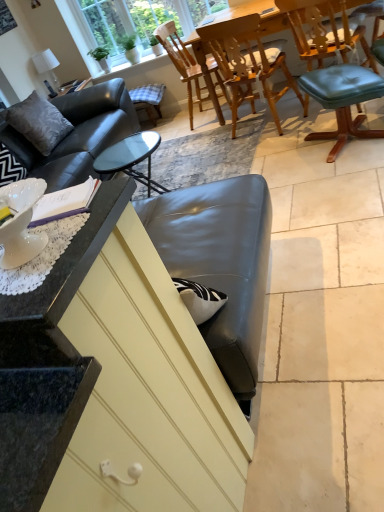
Question: Does wooden chair at upper center, the 1th chair from the left, have a larger size compared to gray suede pillow at upper left?

Choices:
 (A) no
 (B) yes

Answer: (B)

Question: Could gray suede pillow at upper left be considered to be inside wooden chair at upper center, the 1th chair from the left?

Choices:
 (A) yes
 (B) no

Answer: (B)

Question: From the image's perspective, is wooden chair at upper center, marked as the third chair in a right-to-left arrangement, located beneath gray suede pillow at upper left?

Choices:
 (A) no
 (B) yes

Answer: (A)

Question: Is wooden chair at upper center, the 1th chair from the left, facing away from gray suede pillow at upper left?

Choices:
 (A) yes
 (B) no

Answer: (B)

Question: From the image's perspective, is wooden chair at upper center, the 1th chair from the left, located above gray suede pillow at upper left?

Choices:
 (A) yes
 (B) no

Answer: (A)

Question: Can you confirm if wooden chair at upper center, marked as the third chair in a right-to-left arrangement, is positioned to the right of gray suede pillow at upper left?

Choices:
 (A) yes
 (B) no

Answer: (A)

Question: Does teak wood dining table at center lie behind teal leather bar stool at right, acting as the first bar stool starting from the right?

Choices:
 (A) yes
 (B) no

Answer: (A)

Question: Is teak wood dining table at center looking in the opposite direction of teal leather bar stool at right, the first bar stool positioned from the bottom?

Choices:
 (A) no
 (B) yes

Answer: (A)

Question: Does teak wood dining table at center have a lesser height compared to teal leather bar stool at right, marked as the 1th bar stool in a front-to-back arrangement?

Choices:
 (A) yes
 (B) no

Answer: (B)

Question: Would you say teak wood dining table at center is a long distance from teal leather bar stool at right, acting as the first bar stool starting from the right?

Choices:
 (A) no
 (B) yes

Answer: (A)

Question: Is teak wood dining table at center oriented towards teal leather bar stool at right, the first bar stool positioned from the bottom?

Choices:
 (A) yes
 (B) no

Answer: (A)

Question: From the image's perspective, does teak wood dining table at center appear higher than teal leather bar stool at right, marked as the 1th bar stool in a front-to-back arrangement?

Choices:
 (A) no
 (B) yes

Answer: (B)

Question: Does wooden chair at center, placed as the second chair when sorted from right to left, appear on the left side of teak wood dining table at center?

Choices:
 (A) no
 (B) yes

Answer: (B)